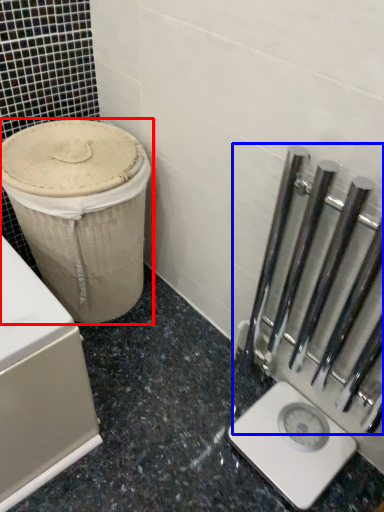
Question: Which of the following is the farthest to the observer, waste container (highlighted by a red box) or rail (highlighted by a blue box)?

Choices:
 (A) waste container
 (B) rail

Answer: (A)